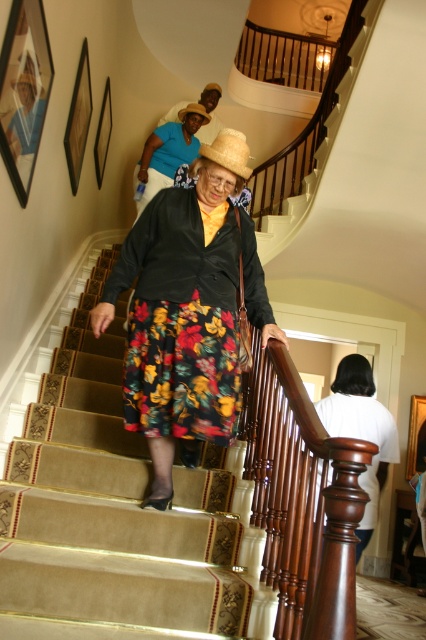
Does carpeted stairs at center have a larger size compared to strawhat at center?

Indeed, carpeted stairs at center has a larger size compared to strawhat at center.

Between carpeted stairs at center and strawhat at center, which one is positioned higher?

Positioned higher is strawhat at center.

Is point (100, 506) closer to viewer compared to point (201, 106)?

Yes, point (100, 506) is closer to viewer.

Identify the location of carpeted stairs at center. (109, 513).

Is floral skirt at center in front of matte black hat at upper center?

Yes, floral skirt at center is closer to the viewer.

Is floral skirt at center positioned behind matte black hat at upper center?

No, it is not.

Does point (161, 316) lie behind point (178, 140)?

That is False.

Where is `floral skirt at center`? The height and width of the screenshot is (640, 426). floral skirt at center is located at coordinates (186, 316).

Measure the distance from white fabric at upper center to strawhat at center.

3.18 meters

This screenshot has height=640, width=426. What do you see at coordinates (360, 432) in the screenshot?
I see `white fabric at upper center` at bounding box center [360, 432].

Is point (356, 532) positioned after point (201, 104)?

No, it is in front of (201, 104).

Find the location of `white fabric at upper center`. white fabric at upper center is located at coordinates (360, 432).